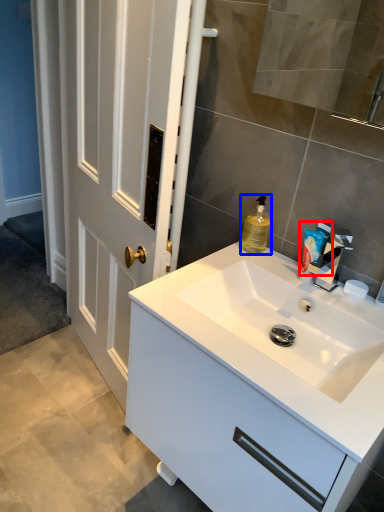
Question: Among these objects, which one is nearest to the camera, toiletry (highlighted by a red box) or cleaning product (highlighted by a blue box)?

Choices:
 (A) toiletry
 (B) cleaning product

Answer: (A)